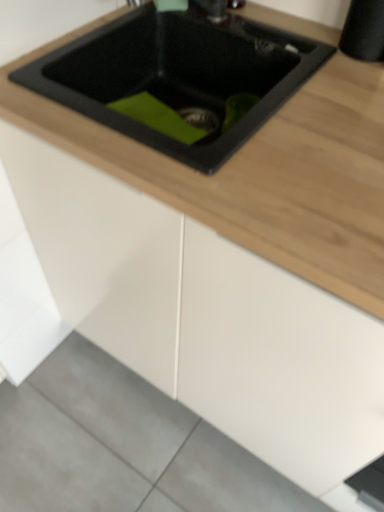
Measure the distance between point (189, 467) and camera.

Point (189, 467) and camera are 1.24 meters apart.

I want to click on gray concrete at lower left, so click(122, 446).

Describe the element at coordinates (122, 446) in the screenshot. I see `gray concrete at lower left` at that location.

Measure the distance between black matte sink at upper center and camera.

A distance of 24.50 inches exists between black matte sink at upper center and camera.

The height and width of the screenshot is (512, 384). Describe the element at coordinates (177, 74) in the screenshot. I see `black matte sink at upper center` at that location.

I want to click on black matte sink at upper center, so click(177, 74).

At what (x,y) coordinates should I click in order to perform the action: click on gray concrete at lower left. Please return your answer as a coordinate pair (x, y). Looking at the image, I should click on (122, 446).

Consider the image. Which is more to the right, gray concrete at lower left or black matte sink at upper center?

Positioned to the right is black matte sink at upper center.

Is gray concrete at lower left positioned behind black matte sink at upper center?

Yes, gray concrete at lower left is behind black matte sink at upper center.

Is point (53, 422) closer or farther from the camera than point (202, 170)?

Point (53, 422).

From the image's perspective, is gray concrete at lower left on top of black matte sink at upper center?

No, from the image's perspective, gray concrete at lower left is not over black matte sink at upper center.

From a real-world perspective, does gray concrete at lower left stand above black matte sink at upper center?

No, from a real-world perspective, gray concrete at lower left is not above black matte sink at upper center.

Considering the sizes of gray concrete at lower left and black matte sink at upper center in the image, is gray concrete at lower left wider or thinner than black matte sink at upper center?

Clearly, gray concrete at lower left has more width compared to black matte sink at upper center.

Is gray concrete at lower left taller or shorter than black matte sink at upper center?

Clearly, gray concrete at lower left is shorter compared to black matte sink at upper center.

Can you confirm if gray concrete at lower left is smaller than black matte sink at upper center?

Yes, gray concrete at lower left is smaller than black matte sink at upper center.

Can we say gray concrete at lower left lies outside black matte sink at upper center?

Yes, gray concrete at lower left is not within black matte sink at upper center.

Is gray concrete at lower left next to black matte sink at upper center?

No, gray concrete at lower left is not beside black matte sink at upper center.

Is gray concrete at lower left oriented towards black matte sink at upper center?

No, gray concrete at lower left does not turn towards black matte sink at upper center.

What's the angular difference between gray concrete at lower left and black matte sink at upper center's facing directions?

0.293 degrees separate the facing orientations of gray concrete at lower left and black matte sink at upper center.

I want to click on sink that is above the gray concrete at lower left (from a real-world perspective), so click(x=177, y=74).

Looking at this image, which is more to the right, black matte sink at upper center or gray concrete at lower left?

From the viewer's perspective, black matte sink at upper center appears more on the right side.

Does black matte sink at upper center come in front of gray concrete at lower left?

Yes, black matte sink at upper center is closer to the camera.

Considering the positions of point (225, 40) and point (153, 433), is point (225, 40) closer or farther from the camera than point (153, 433)?

Point (225, 40) is positioned closer to the camera compared to point (153, 433).

From the image's perspective, would you say black matte sink at upper center is shown under gray concrete at lower left?

No, from the image's perspective, black matte sink at upper center is not below gray concrete at lower left.

From a real-world perspective, which object stands above the other?

In real-world perspective, black matte sink at upper center is above.

Does black matte sink at upper center have a greater width compared to gray concrete at lower left?

In fact, black matte sink at upper center might be narrower than gray concrete at lower left.

In terms of height, does black matte sink at upper center look taller or shorter compared to gray concrete at lower left?

Considering their sizes, black matte sink at upper center has more height than gray concrete at lower left.

Is black matte sink at upper center bigger or smaller than gray concrete at lower left?

Clearly, black matte sink at upper center is larger in size than gray concrete at lower left.

Can we say black matte sink at upper center lies outside gray concrete at lower left?

Yes, black matte sink at upper center is not within gray concrete at lower left.

Is black matte sink at upper center placed right next to gray concrete at lower left?

black matte sink at upper center and gray concrete at lower left are not in contact.

Is black matte sink at upper center aimed at gray concrete at lower left?

No, black matte sink at upper center is not aimed at gray concrete at lower left.

How different are the orientations of black matte sink at upper center and gray concrete at lower left in degrees?

The angle between the facing direction of black matte sink at upper center and the facing direction of gray concrete at lower left is 0.293 degrees.

How much distance is there between black matte sink at upper center and gray concrete at lower left?

black matte sink at upper center and gray concrete at lower left are 37.36 inches apart from each other.

At what (x,y) coordinates should I click in order to perform the action: click on sink in front of the gray concrete at lower left. Please return your answer as a coordinate pair (x, y). This screenshot has width=384, height=512. Looking at the image, I should click on (177, 74).

This screenshot has width=384, height=512. I want to click on sink above the gray concrete at lower left (from a real-world perspective), so click(177, 74).

I want to click on concrete below the black matte sink at upper center (from the image's perspective), so click(x=122, y=446).